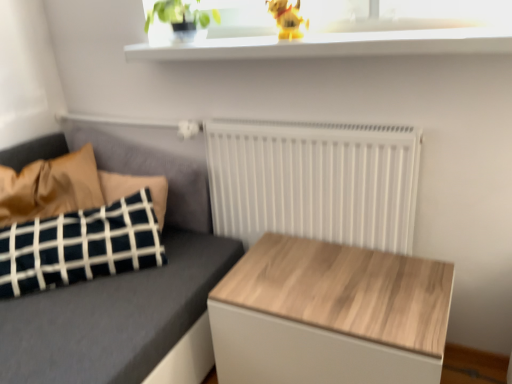
Where is `free location to the right of green matte plant at upper center`? This screenshot has width=512, height=384. free location to the right of green matte plant at upper center is located at coordinates (239, 38).